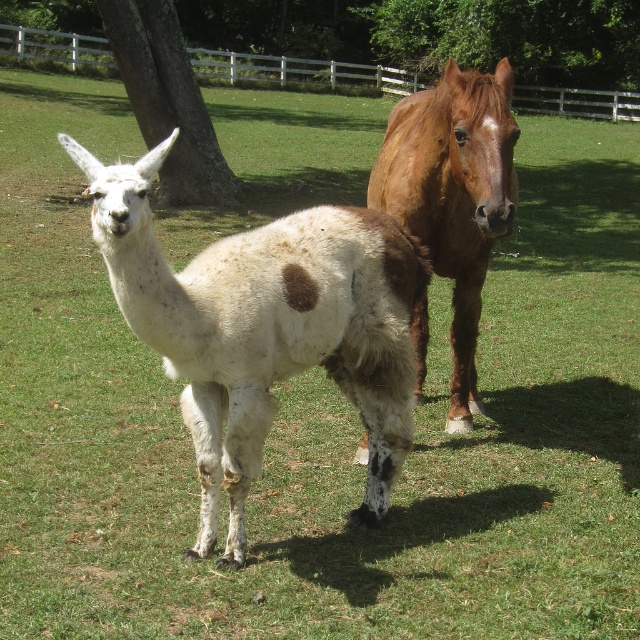
You are standing at the lower left corner of the image. You want to walk straight ahead to the center of the image. Will you encounter the llama with white coat and brown spots on its side and hindquarters before reaching the point marked at coordinate [266,326]?

The point marked at coordinate [266,326] is the location of the white woolly alpaca at center. Since you are walking straight ahead from the lower left corner towards the center, you would first encounter the llama with white coat and brown spots on its side and hindquarters before reaching the point marked at coordinate [266,326] because the llama is in the foreground and closer to the viewer than the alpaca at the marked point.

You are a photographer setting up a tripod in front of the brown glossy horse at center and the green leafy tree at upper center. You want to ensure both are in focus. Since the horse is closer to you, will you need to adjust the focus to capture both clearly?

The brown glossy horse at center is taller than the green leafy tree at upper center. Since the horse is closer, you should focus on it first. The tree in the background may already be in focus due to depth of field, but you might need to adjust the aperture for both to be clear.

You are a photographer trying to capture a photo of the brown glossy horse at center and the brown rough tree at upper left. You want to ensure both subjects are in the frame. Based on their positions, which object is located to the right side of the other?

The brown glossy horse at center is to the right of the brown rough tree at upper left.